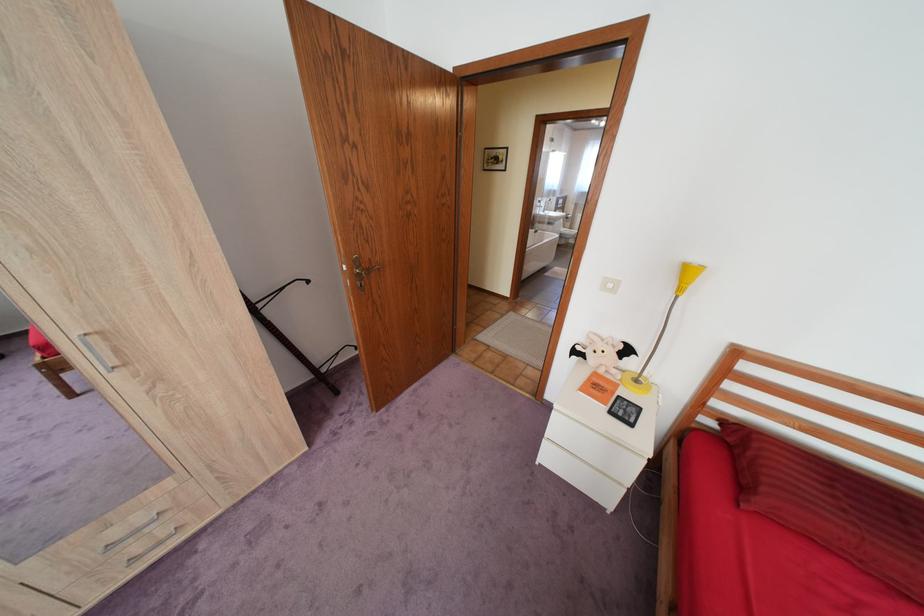
The location [599,387] corresponds to which object?

This point indicates the orange book.